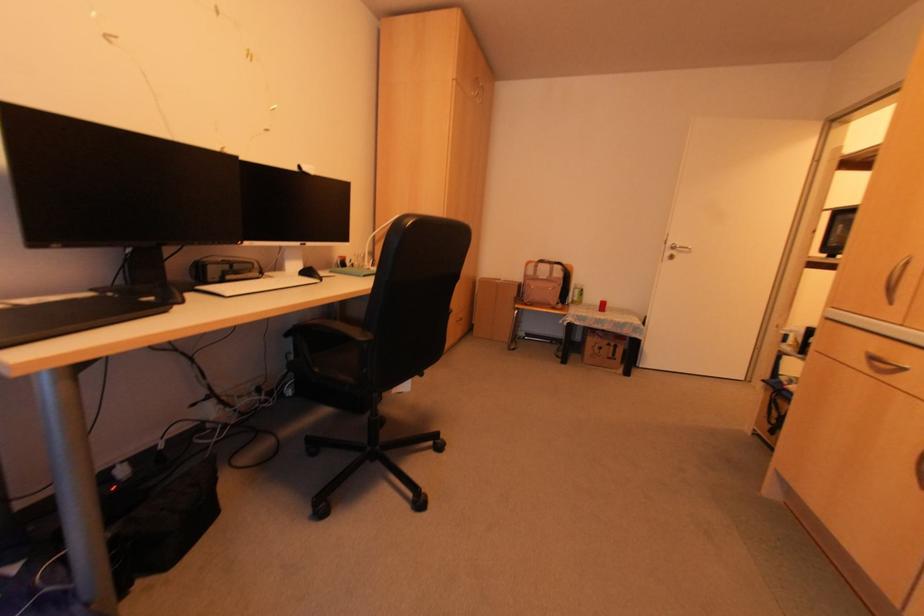
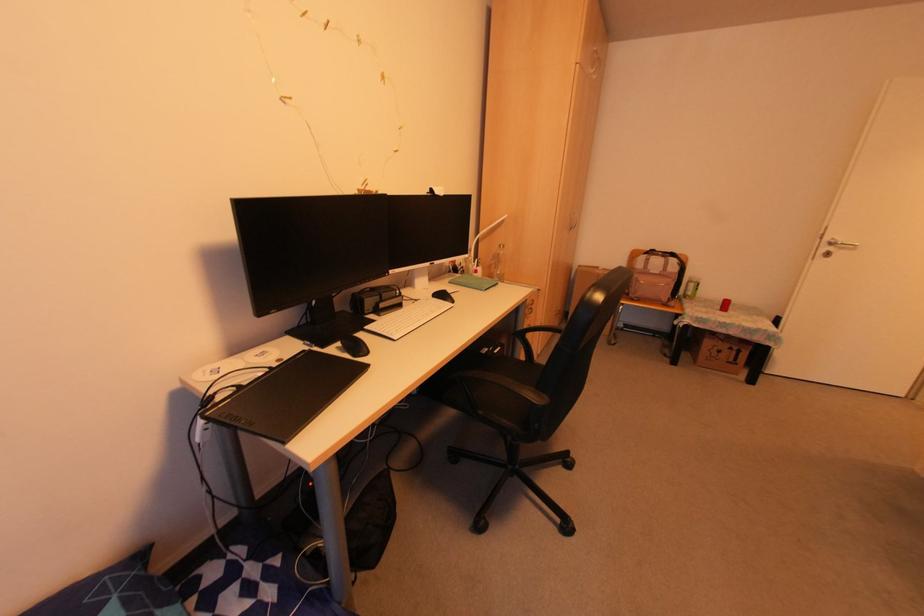
The point at (542,278) is marked in the first image. Where is the corresponding point in the second image?

(655, 273)